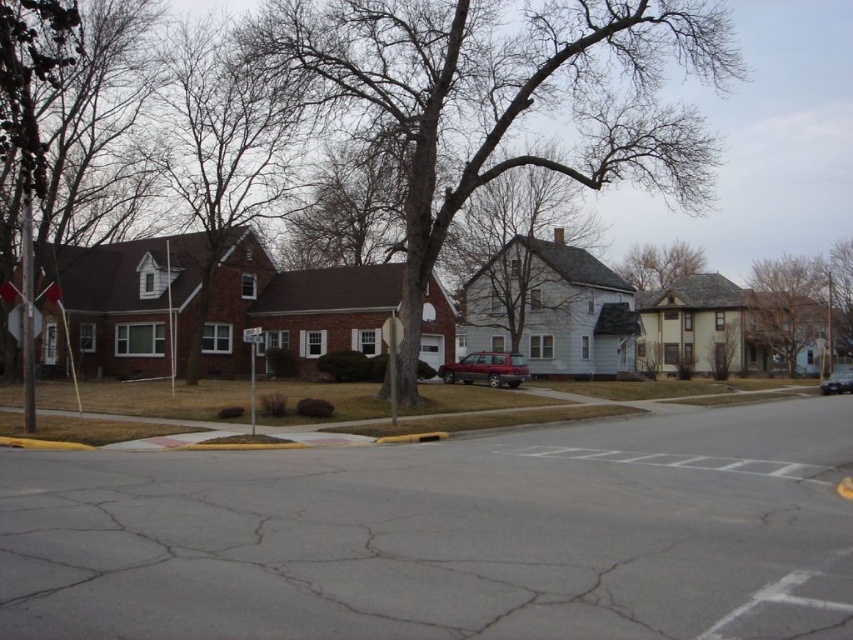
Who is more forward, (x=634, y=244) or (x=20, y=321)?

Point (x=20, y=321)

Which is behind, point (653, 259) or point (39, 310)?

Positioned behind is point (653, 259).

What do you see at coordinates (659, 262) in the screenshot? I see `brown textured tree at upper center` at bounding box center [659, 262].

Find the location of a particular element. This screenshot has height=640, width=853. brown textured tree at upper center is located at coordinates (659, 262).

Locate an element on the screen. metallic silver stop sign at left is located at coordinates [x=15, y=321].

Does point (10, 324) come farther from viewer compared to point (844, 384)?

No, (10, 324) is closer to viewer.

Is point (35, 308) more distant than point (850, 376)?

No, (35, 308) is in front of (850, 376).

Locate an element on the screen. Image resolution: width=853 pixels, height=640 pixels. metallic silver stop sign at left is located at coordinates click(x=15, y=321).

What do you see at coordinates (511, 241) in the screenshot?
I see `smooth bark tree at center` at bounding box center [511, 241].

Where is `smooth bark tree at center`? smooth bark tree at center is located at coordinates (511, 241).